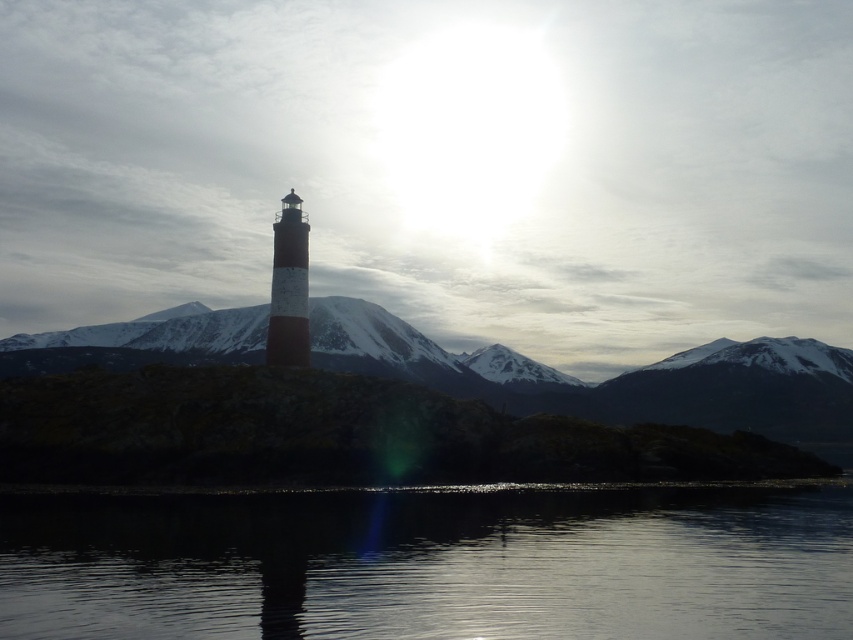
Question: Which of the following is the farthest from the observer?

Choices:
 (A) white painted metal lighthouse at center
 (B) transparent glass water at center

Answer: (A)

Question: Which point is farther to the camera?

Choices:
 (A) transparent glass water at center
 (B) white painted metal lighthouse at center

Answer: (B)

Question: Which point is farther to the camera?

Choices:
 (A) (312, 636)
 (B) (303, 342)

Answer: (B)

Question: Does transparent glass water at center appear on the left side of white painted metal lighthouse at center?

Choices:
 (A) yes
 (B) no

Answer: (B)

Question: Does transparent glass water at center have a greater width compared to white painted metal lighthouse at center?

Choices:
 (A) no
 (B) yes

Answer: (B)

Question: Is transparent glass water at center closer to the viewer compared to white painted metal lighthouse at center?

Choices:
 (A) yes
 (B) no

Answer: (A)